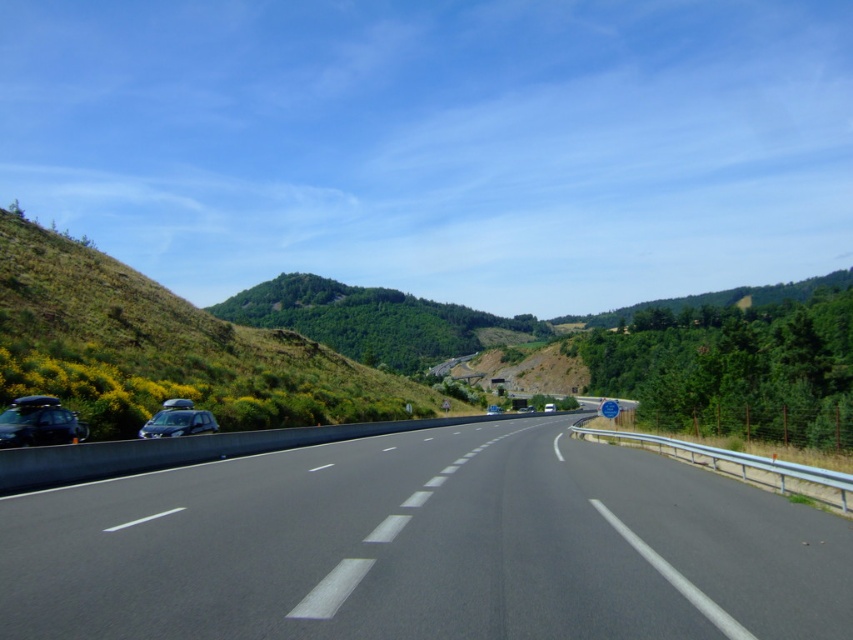
You are a drone operator planning to take a photo of the black asphalt highway at center. To ensure the highway is centered in the frame, where should you position your camera? Please provide coordinates based on the image grid where the top left corner is the origin point.

The black asphalt highway at center is located at point (424, 547), so you should position your camera at those coordinates to center it in the frame.

You are a drone operator trying to capture a photo of the black asphalt highway at center and the satin silver car at left from above. Based on the scene description, which object should appear larger in the photo?

The black asphalt highway at center appears larger in the photo because it is taller than the satin silver car at left according to the description.

You are driving a car and want to overtake the satin silver car at left. The road ahead has a solid yellow line. Can you safely overtake the silver metallic van at center while staying on the right side of the road?

The satin silver car at left is in front of the silver metallic van at center. Since the satin silver car is ahead, overtaking would require moving into the opposite lane where the solid yellow line prohibits passing. Therefore, you cannot safely overtake the silver metallic van at center while staying on the right side of the road.